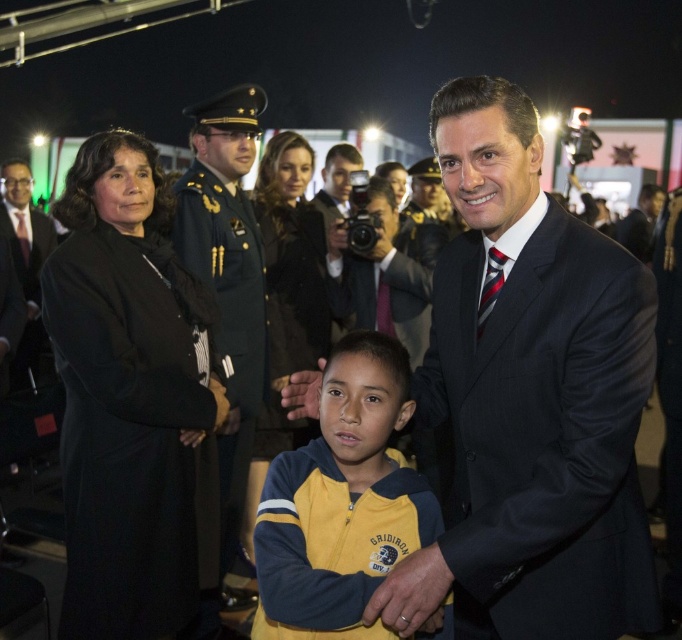
You are a photographer at this event and need to capture a group photo. The shiny dark blue uniform at center and the matte black suit at left are part of the group. Considering their widths, which one should you position closer to the edges to avoid overcrowding the frame?

The shiny dark blue uniform at center has a lesser width compared to the matte black suit at left. Therefore, you should position the matte black suit at left closer to the edges to avoid overcrowding the frame since it is wider.

You are a photographer at the event and want to capture a clear photo of both the black wool coat at left and the matte black suit at left. Since they are both black, which one should you focus on first to ensure the subject in front is sharp?

The black wool coat at left is in front of the matte black suit at left, so you should focus on the black wool coat at left first to ensure the subject in front is sharp.